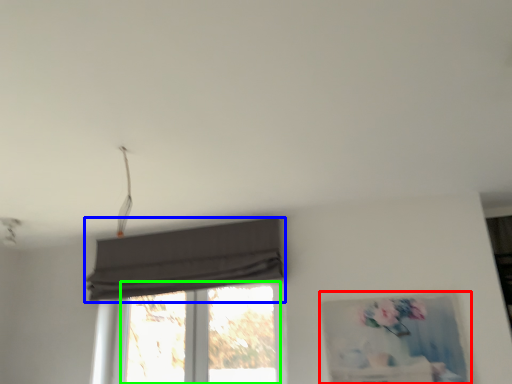
Question: Which object is positioned farthest from picture frame (highlighted by a red box)? Select from curtain (highlighted by a blue box) and window (highlighted by a green box).

Choices:
 (A) curtain
 (B) window

Answer: (A)